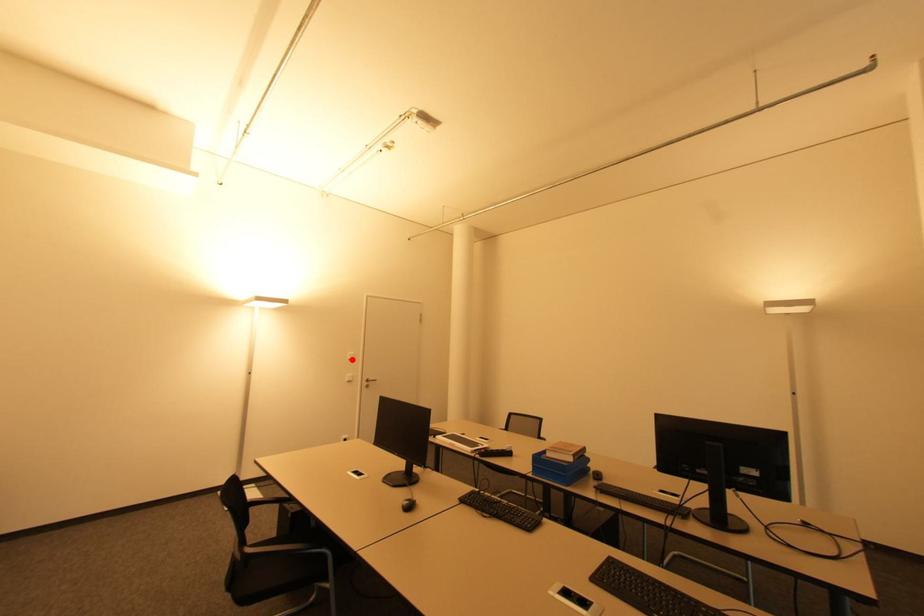
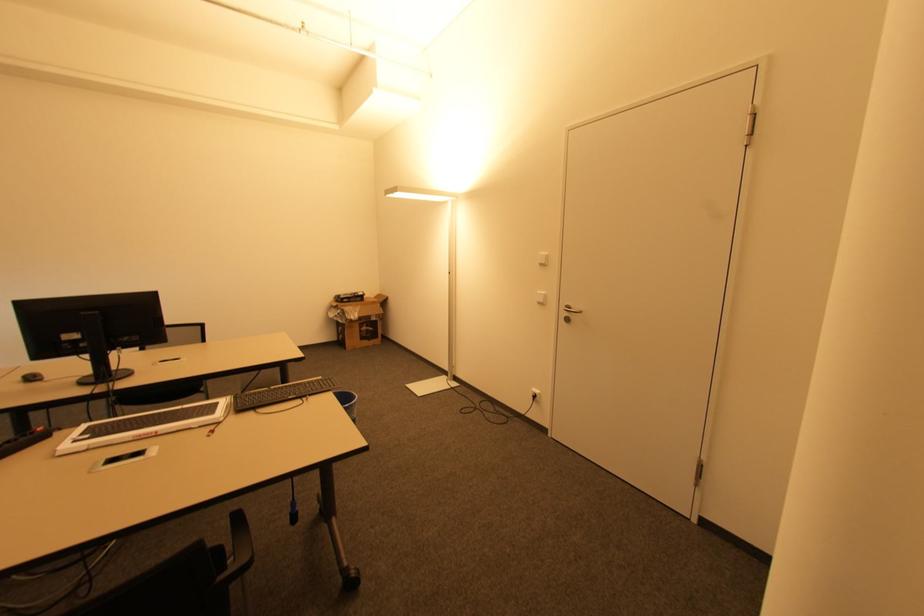
Question: I am providing you with two images of the same scene from different viewpoints. A red point is marked on the first image. At the location where the point appears in image 1, is it still visible in image 2?

Choices:
 (A) Yes
 (B) No

Answer: (A)